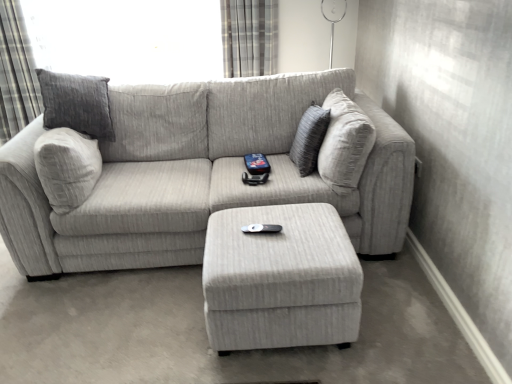
Measure the distance between point (303, 154) and camera.

Point (303, 154) is 2.19 meters away from camera.

The height and width of the screenshot is (384, 512). Find the location of `plaid fabric curtain at upper center, arranged as the first curtain when viewed from the right`. plaid fabric curtain at upper center, arranged as the first curtain when viewed from the right is located at coordinates (249, 37).

This screenshot has height=384, width=512. Describe the element at coordinates (249, 37) in the screenshot. I see `plaid fabric curtain at upper center, placed as the 2th curtain when sorted from left to right` at that location.

How much space does gray textured curtain at upper left, the 2th curtain positioned from the right, occupy horizontally?

gray textured curtain at upper left, the 2th curtain positioned from the right, is 12.69 inches in width.

Measure the distance between gray textured curtain at upper left, the 2th curtain positioned from the right, and camera.

gray textured curtain at upper left, the 2th curtain positioned from the right, and camera are 2.91 meters apart.

Locate an element on the screen. This screenshot has height=384, width=512. light gray fabric ottoman at center is located at coordinates (280, 279).

Where is `textured gray pillow at center`? The width and height of the screenshot is (512, 384). textured gray pillow at center is located at coordinates 309,139.

Would you say light gray fabric ottoman at center is a long distance from plaid fabric curtain at upper center, placed as the 2th curtain when sorted from left to right?

Yes, light gray fabric ottoman at center and plaid fabric curtain at upper center, placed as the 2th curtain when sorted from left to right, are located far from each other.

Is light gray fabric ottoman at center positioned with its back to plaid fabric curtain at upper center, arranged as the first curtain when viewed from the right?

No, light gray fabric ottoman at center's orientation is not away from plaid fabric curtain at upper center, arranged as the first curtain when viewed from the right.

Is the depth of light gray fabric ottoman at center less than that of plaid fabric curtain at upper center, arranged as the first curtain when viewed from the right?

Yes, light gray fabric ottoman at center is closer to the viewer.

In the scene shown: Between light gray fabric ottoman at center and plaid fabric curtain at upper center, arranged as the first curtain when viewed from the right, which one appears on the right side from the viewer's perspective?

light gray fabric ottoman at center.

Considering the relative sizes of light gray fabric ottoman at center and gray textured curtain at upper left, which is the 1th curtain in left-to-right order, in the image provided, is light gray fabric ottoman at center shorter than gray textured curtain at upper left, which is the 1th curtain in left-to-right order,?

Indeed, light gray fabric ottoman at center has a lesser height compared to gray textured curtain at upper left, which is the 1th curtain in left-to-right order.

Locate an element on the screen. table that appears below the gray textured curtain at upper left, which is the 1th curtain in left-to-right order (from the image's perspective) is located at coordinates (280, 279).

From the picture: Looking at the image, does light gray fabric ottoman at center seem bigger or smaller compared to gray textured curtain at upper left, which is the 1th curtain in left-to-right order?

light gray fabric ottoman at center is smaller than gray textured curtain at upper left, which is the 1th curtain in left-to-right order.

Is light gray fabric ottoman at center positioned with its back to gray textured curtain at upper left, the 2th curtain positioned from the right?

light gray fabric ottoman at center does not have its back to gray textured curtain at upper left, the 2th curtain positioned from the right.

Is black plastic remote at center aimed at plaid fabric curtain at upper center, placed as the 2th curtain when sorted from left to right?

No.

Looking at their sizes, would you say black plastic remote at center is wider or thinner than plaid fabric curtain at upper center, arranged as the first curtain when viewed from the right?

Considering their sizes, black plastic remote at center looks slimmer than plaid fabric curtain at upper center, arranged as the first curtain when viewed from the right.

Does black plastic remote at center come behind plaid fabric curtain at upper center, placed as the 2th curtain when sorted from left to right?

No, black plastic remote at center is closer to the viewer.

What's the angular difference between black plastic remote at center and plaid fabric curtain at upper center, arranged as the first curtain when viewed from the right,'s facing directions?

black plastic remote at center and plaid fabric curtain at upper center, arranged as the first curtain when viewed from the right, are facing 6.13 degrees away from each other.

Which is farther from the camera, (278, 163) or (318, 112)?

The point (278, 163) is farther.

In the scene shown: Could you tell me if textured gray couch at center is facing textured gray pillow at center?

Yes.

Looking at this image, is textured gray couch at center not near textured gray pillow at center?

They are positioned close to each other.

Is plaid fabric curtain at upper center, arranged as the first curtain when viewed from the right, oriented towards gray textured curtain at upper left, the 2th curtain positioned from the right?

No, plaid fabric curtain at upper center, arranged as the first curtain when viewed from the right, is not facing towards gray textured curtain at upper left, the 2th curtain positioned from the right.

From a real-world perspective, is plaid fabric curtain at upper center, arranged as the first curtain when viewed from the right, positioned above or below gray textured curtain at upper left, the 2th curtain positioned from the right?

Clearly, from a real-world perspective, plaid fabric curtain at upper center, arranged as the first curtain when viewed from the right, is above gray textured curtain at upper left, the 2th curtain positioned from the right.

Does plaid fabric curtain at upper center, arranged as the first curtain when viewed from the right, have a larger size compared to gray textured curtain at upper left, the 2th curtain positioned from the right?

No.

Locate an element on the screen. The width and height of the screenshot is (512, 384). curtain positioned vertically above the gray textured curtain at upper left, the 2th curtain positioned from the right (from a real-world perspective) is located at coordinates (249, 37).

Is textured gray couch at center to the left or to the right of gray textured curtain at upper left, which is the 1th curtain in left-to-right order, in the image?

Clearly, textured gray couch at center is on the right of gray textured curtain at upper left, which is the 1th curtain in left-to-right order, in the image.

Can you confirm if textured gray couch at center is shorter than gray textured curtain at upper left, the 2th curtain positioned from the right?

Yes, textured gray couch at center is shorter than gray textured curtain at upper left, the 2th curtain positioned from the right.

Based on the photo, how many degrees apart are the facing directions of textured gray couch at center and gray textured curtain at upper left, which is the 1th curtain in left-to-right order?

The angular difference between textured gray couch at center and gray textured curtain at upper left, which is the 1th curtain in left-to-right order, is 4.1 degrees.

Is textured gray couch at center positioned beyond the bounds of gray textured curtain at upper left, the 2th curtain positioned from the right?

Yes, textured gray couch at center is located beyond the bounds of gray textured curtain at upper left, the 2th curtain positioned from the right.

Considering the relative sizes of gray textured curtain at upper left, which is the 1th curtain in left-to-right order, and textured gray pillow at center in the image provided, is gray textured curtain at upper left, which is the 1th curtain in left-to-right order, thinner than textured gray pillow at center?

Incorrect, the width of gray textured curtain at upper left, which is the 1th curtain in left-to-right order, is not less than that of textured gray pillow at center.

Based on the photo, between gray textured curtain at upper left, which is the 1th curtain in left-to-right order, and textured gray pillow at center, which one has larger size?

gray textured curtain at upper left, which is the 1th curtain in left-to-right order.

From the image's perspective, is gray textured curtain at upper left, the 2th curtain positioned from the right, located beneath textured gray pillow at center?

No, from the image's perspective, gray textured curtain at upper left, the 2th curtain positioned from the right, is not below textured gray pillow at center.

Identify the location of the 2nd curtain behind the light gray fabric ottoman at center, counting from the anchor's position. The width and height of the screenshot is (512, 384). (249, 37).

Locate an element on the screen. The image size is (512, 384). table in front of the gray textured curtain at upper left, the 2th curtain positioned from the right is located at coordinates (280, 279).

When comparing their distances from gray textured curtain at upper left, the 2th curtain positioned from the right, does black plastic remote at center or textured gray pillow at center seem closer?

textured gray pillow at center.

From the image, which object appears to be farther from textured gray pillow at center, light gray fabric ottoman at center or gray textured curtain at upper left, which is the 1th curtain in left-to-right order?

gray textured curtain at upper left, which is the 1th curtain in left-to-right order, is positioned further to the anchor textured gray pillow at center.

From the image, which object appears to be farther from light gray fabric ottoman at center, black plastic remote at center or textured gray couch at center?

textured gray couch at center.

Estimate the real-world distances between objects in this image. Which object is closer to black plastic remote at center, plaid fabric curtain at upper center, arranged as the first curtain when viewed from the right, or light gray fabric ottoman at center?

light gray fabric ottoman at center.

Looking at the image, which one is located further to plaid fabric curtain at upper center, arranged as the first curtain when viewed from the right, gray textured curtain at upper left, which is the 1th curtain in left-to-right order, or textured gray couch at center?

Among the two, gray textured curtain at upper left, which is the 1th curtain in left-to-right order, is located further to plaid fabric curtain at upper center, arranged as the first curtain when viewed from the right.

Based on their spatial positions, is textured gray pillow at center or black plastic remote at center further from textured gray couch at center?

black plastic remote at center is positioned further to the anchor textured gray couch at center.

Looking at the image, which one is located closer to textured gray pillow at center, gray textured curtain at upper left, which is the 1th curtain in left-to-right order, or textured gray couch at center?

textured gray couch at center is closer to textured gray pillow at center.

Estimate the real-world distances between objects in this image. Which object is closer to textured gray pillow at center, gray textured curtain at upper left, the 2th curtain positioned from the right, or plaid fabric curtain at upper center, placed as the 2th curtain when sorted from left to right?

plaid fabric curtain at upper center, placed as the 2th curtain when sorted from left to right, is positioned closer to the anchor textured gray pillow at center.

At what (x,y) coordinates should I click in order to perform the action: click on curtain between gray textured curtain at upper left, the 2th curtain positioned from the right, and black plastic remote at center. Please return your answer as a coordinate pair (x, y). The image size is (512, 384). Looking at the image, I should click on (249, 37).

Image resolution: width=512 pixels, height=384 pixels. Identify the location of table between gray textured curtain at upper left, which is the 1th curtain in left-to-right order, and textured gray pillow at center, in the horizontal direction. (280, 279).

Locate an element on the screen. pillow between plaid fabric curtain at upper center, arranged as the first curtain when viewed from the right, and black plastic remote at center vertically is located at coordinates (309, 139).

Locate an element on the screen. This screenshot has height=384, width=512. studio couch between gray textured curtain at upper left, the 2th curtain positioned from the right, and plaid fabric curtain at upper center, arranged as the first curtain when viewed from the right, from left to right is located at coordinates (195, 175).